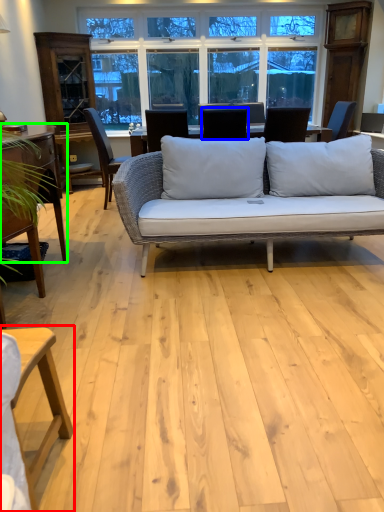
Question: Based on their relative distances, which object is nearer to table (highlighted by a red box)? Choose from chair (highlighted by a blue box) and table (highlighted by a green box).

Choices:
 (A) chair
 (B) table

Answer: (B)